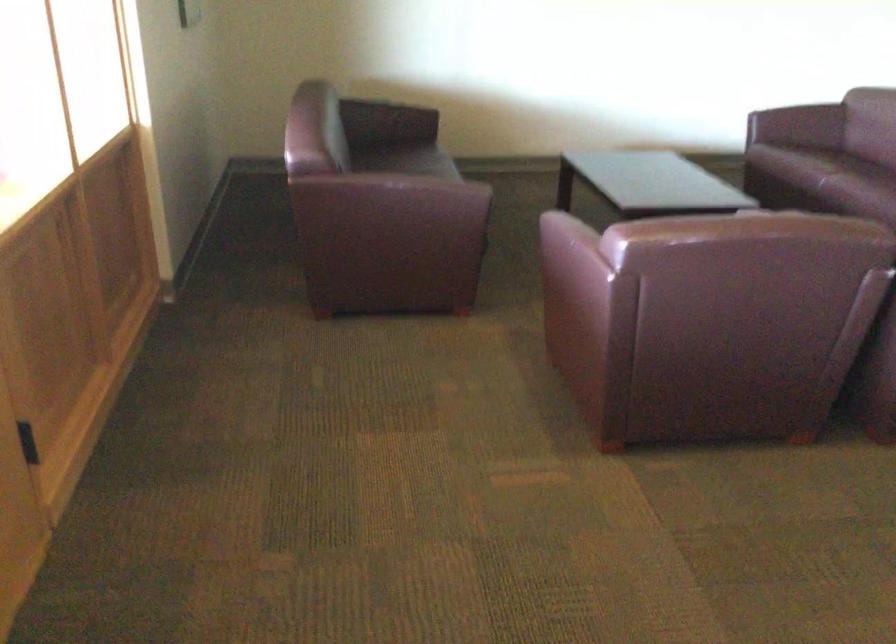
Image resolution: width=896 pixels, height=644 pixels. In order to click on sofa sitting surface in this screenshot , I will do `click(401, 160)`.